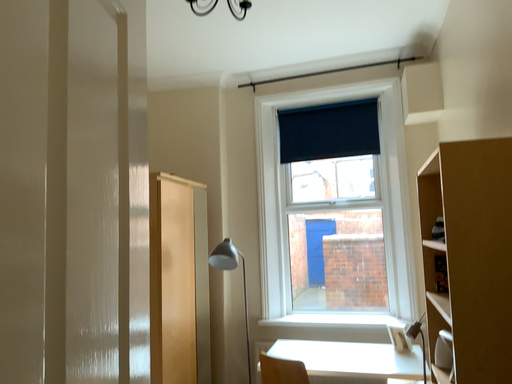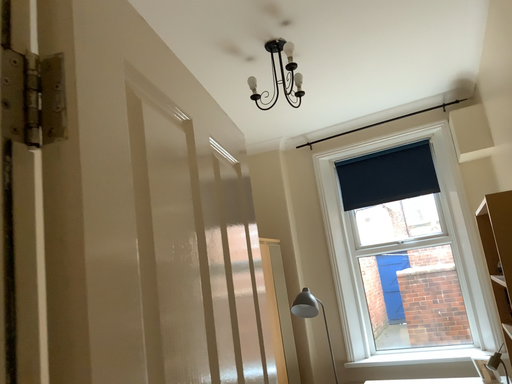
Question: Which way did the camera rotate in the video?

Choices:
 (A) rotated right
 (B) rotated left

Answer: (B)